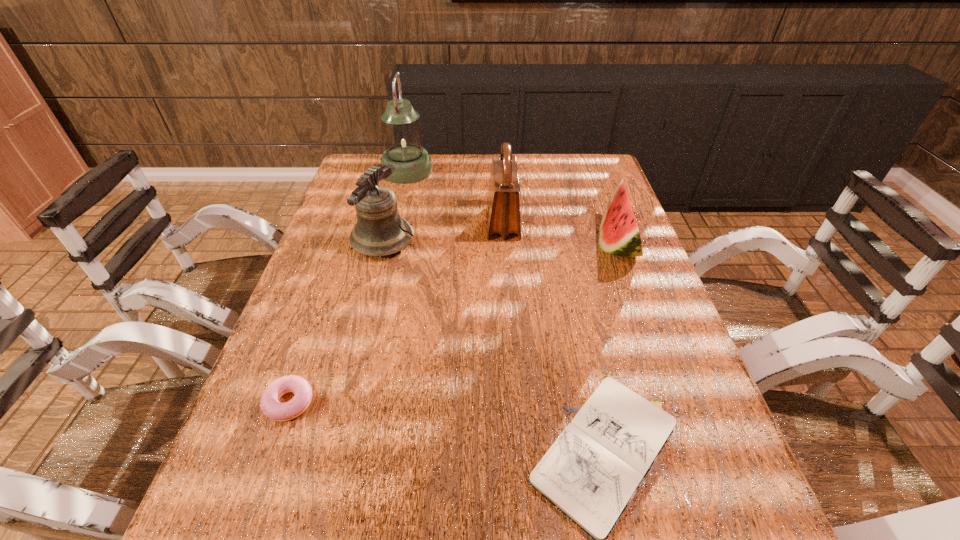
At what (x,y) coordinates should I click in order to perform the action: click on blank space located on the back of the bell. Please return your answer as a coordinate pair (x, y). Looking at the image, I should click on (404, 158).

This screenshot has height=540, width=960. In order to click on free space located on the outer rind of the watermelon in this screenshot , I will do `click(454, 245)`.

Locate an element on the screen. This screenshot has width=960, height=540. blank area located 0.260m on the outer rind of the watermelon is located at coordinates (504, 245).

The width and height of the screenshot is (960, 540). Find the location of `free location located 0.070m on the outer rind of the watermelon`. free location located 0.070m on the outer rind of the watermelon is located at coordinates (572, 245).

This screenshot has height=540, width=960. What are the coordinates of `free location located 0.060m on the right of the second shortest object` in the screenshot? It's located at (345, 402).

I want to click on object present at the far edge, so click(x=402, y=135).

The height and width of the screenshot is (540, 960). What are the coordinates of `lantern at the left edge` in the screenshot? It's located at (402, 135).

Image resolution: width=960 pixels, height=540 pixels. Find the location of `bell that is positioned at the left edge`. bell that is positioned at the left edge is located at coordinates (379, 231).

The width and height of the screenshot is (960, 540). Find the location of `doughnut located in the left edge section of the desktop`. doughnut located in the left edge section of the desktop is located at coordinates (271, 407).

Where is `object that is at the right edge`? The width and height of the screenshot is (960, 540). object that is at the right edge is located at coordinates (619, 235).